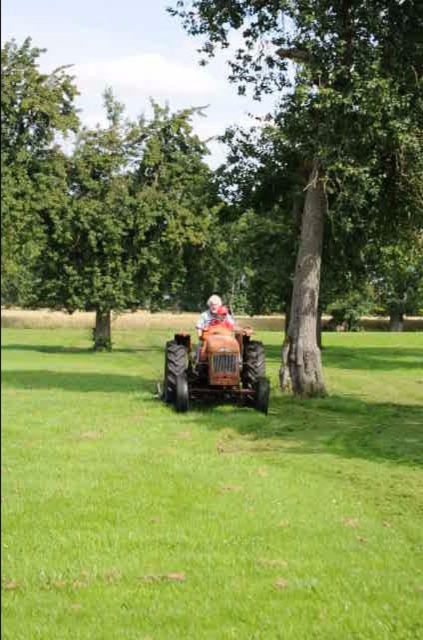
Who is higher up, green leafy tree at upper left or white fabric hat at center?

Positioned higher is green leafy tree at upper left.

You are a GUI agent. You are given a task and a screenshot of the screen. Output one action in this format:
    pyautogui.click(x=<x>, y=<y>)
    Task: Click on the green leafy tree at upper left
    Image resolution: width=423 pixels, height=640 pixels.
    Given the screenshot: What is the action you would take?
    (95, 196)

Who is more forward, (154, 260) or (208, 323)?

Point (208, 323) is more forward.

Where is `green leafy tree at upper left`? green leafy tree at upper left is located at coordinates (95, 196).

Who is positioned more to the left, green leafy tree at upper left or smooth bark tree at center?

From the viewer's perspective, green leafy tree at upper left appears more on the left side.

Is point (18, 298) positioned in front of point (360, 157)?

No, (18, 298) is behind (360, 157).

Does point (96, 150) come behind point (252, 83)?

Yes, point (96, 150) is farther from viewer.

Where is `green leafy tree at upper left`? Image resolution: width=423 pixels, height=640 pixels. green leafy tree at upper left is located at coordinates 95,196.

Can you confirm if smooth bark tree at center is positioned above white fabric hat at center?

Correct, smooth bark tree at center is located above white fabric hat at center.

Is smooth bark tree at center wider than white fabric hat at center?

Indeed, smooth bark tree at center has a greater width compared to white fabric hat at center.

Does point (390, 72) come farther from viewer compared to point (219, 301)?

That is False.

You are a GUI agent. You are given a task and a screenshot of the screen. Output one action in this format:
    pyautogui.click(x=<x>, y=<y>)
    Task: Click on the smooth bark tree at center
    Image resolution: width=423 pixels, height=640 pixels.
    Given the screenshot: What is the action you would take?
    pyautogui.click(x=329, y=120)